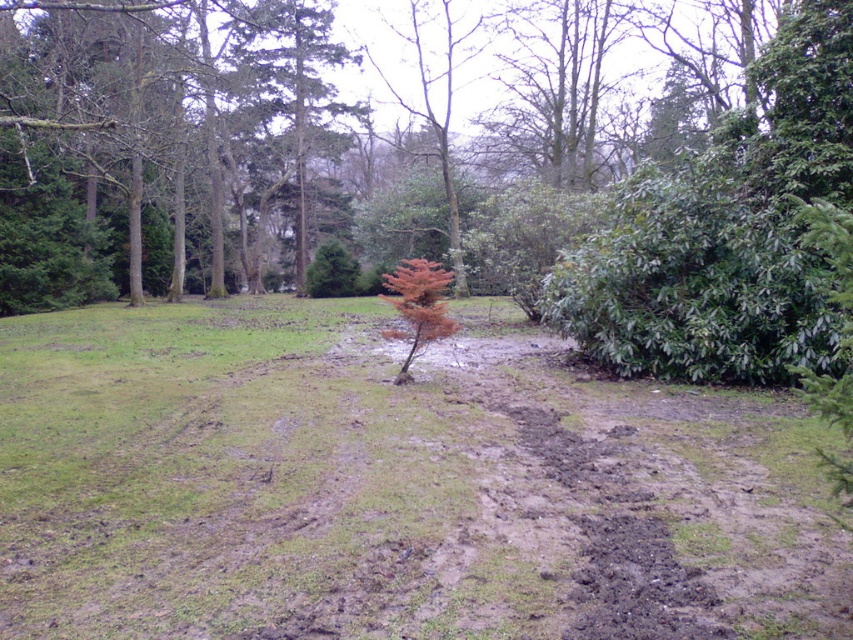
Can you confirm if green grass at center is positioned to the left of brown textured tree at upper center?

Incorrect, green grass at center is not on the left side of brown textured tree at upper center.

Between green grass at center and brown textured tree at upper center, which one has more height?

Standing taller between the two is brown textured tree at upper center.

Does point (733, 502) come in front of point (309, 120)?

Yes.

This screenshot has height=640, width=853. I want to click on green grass at center, so click(x=392, y=484).